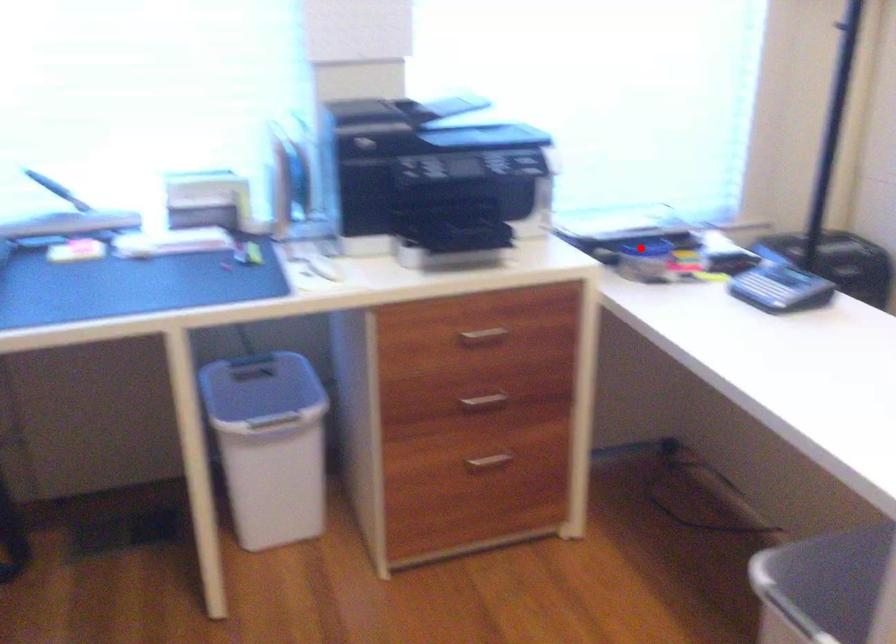
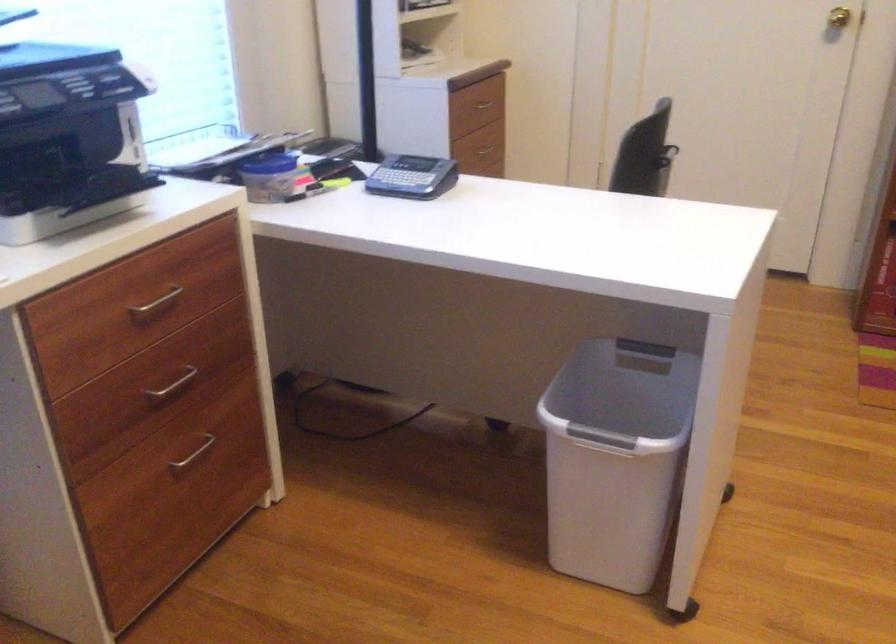
Locate, in the second image, the point that corresponds to the highlighted location in the first image.

(270, 164)